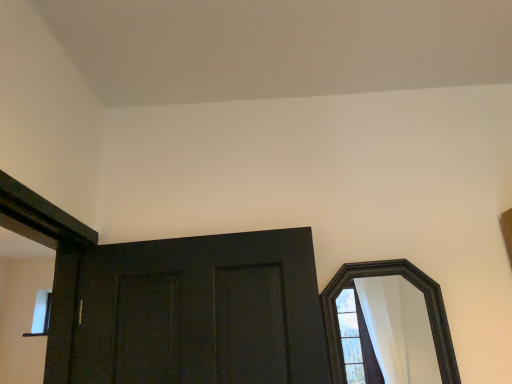
What do you see at coordinates (41, 314) in the screenshot? I see `clear glass window at left` at bounding box center [41, 314].

In order to face clear glass window at left, should I rotate leftwards or rightwards?

To face it directly, rotate left by 26.960 degrees.

This screenshot has height=384, width=512. Find the location of `clear glass window at left`. clear glass window at left is located at coordinates (41, 314).

Where is `clear glass window at left`? Image resolution: width=512 pixels, height=384 pixels. clear glass window at left is located at coordinates (41, 314).